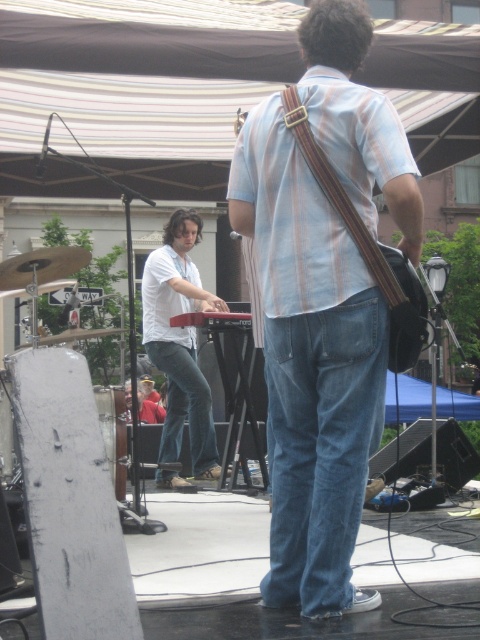
Is point (336, 545) positioned before point (151, 268)?

Yes, point (336, 545) is in front of point (151, 268).

Can you confirm if light blue striped shirt at center is wider than white matte keyboard at center?

Yes.

Find the location of `light blue striped shirt at center`. light blue striped shirt at center is located at coordinates (311, 368).

Is denim jeans at center to the right of white matte keyboard at center from the viewer's perspective?

Correct, you'll find denim jeans at center to the right of white matte keyboard at center.

Between denim jeans at center and white matte keyboard at center, which one appears on the left side from the viewer's perspective?

Positioned to the left is white matte keyboard at center.

Which is in front, point (371, 307) or point (180, 243)?

Point (371, 307) is in front.

Locate an element on the screen. The height and width of the screenshot is (640, 480). denim jeans at center is located at coordinates (322, 445).

Measure the distance between light blue striped shirt at center and denim jeans at center.

The distance of light blue striped shirt at center from denim jeans at center is 4.75 inches.

Is the position of light blue striped shirt at center less distant than that of denim jeans at center?

Yes, light blue striped shirt at center is closer to the viewer.

Between point (334, 573) and point (299, 396), which one is positioned behind?

The point (299, 396) is behind.

Where is `light blue striped shirt at center`? light blue striped shirt at center is located at coordinates pyautogui.click(x=311, y=368).